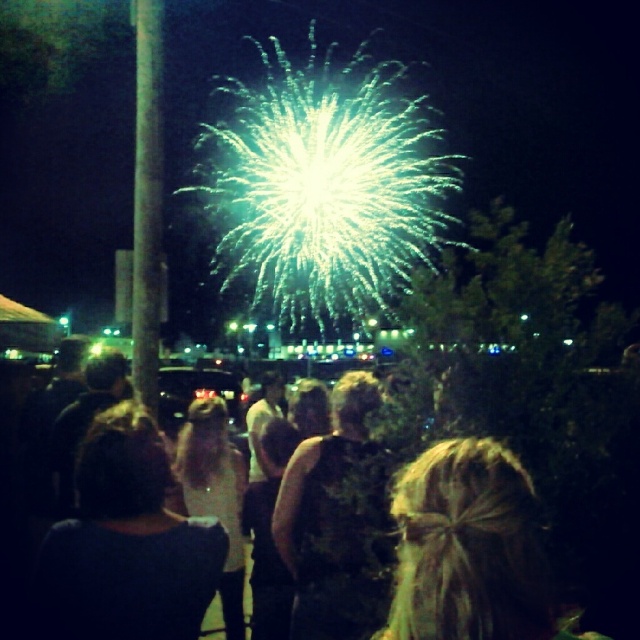
You are standing at the origin point of the coordinate system in the image. You want to walk towards the smooth metallic pole at left. Which direction should you head?

The smooth metallic pole at left is located at coordinate point (147, 200). Since the x coordinate is 0.314, you should move to the right. The y coordinate is 0.230, so you should move downward. Therefore, you should head towards the right and downward direction to reach the smooth metallic pole at left.

Consider the image. You are standing in the crowd watching the fireworks. You want to move to the smooth metallic pole at left to tie your scarf. Which direction should you walk from your current position among the black fabric crowd at center?

You should walk to the left from the black fabric crowd at center to reach the smooth metallic pole at left since it is located to the left of the crowd.